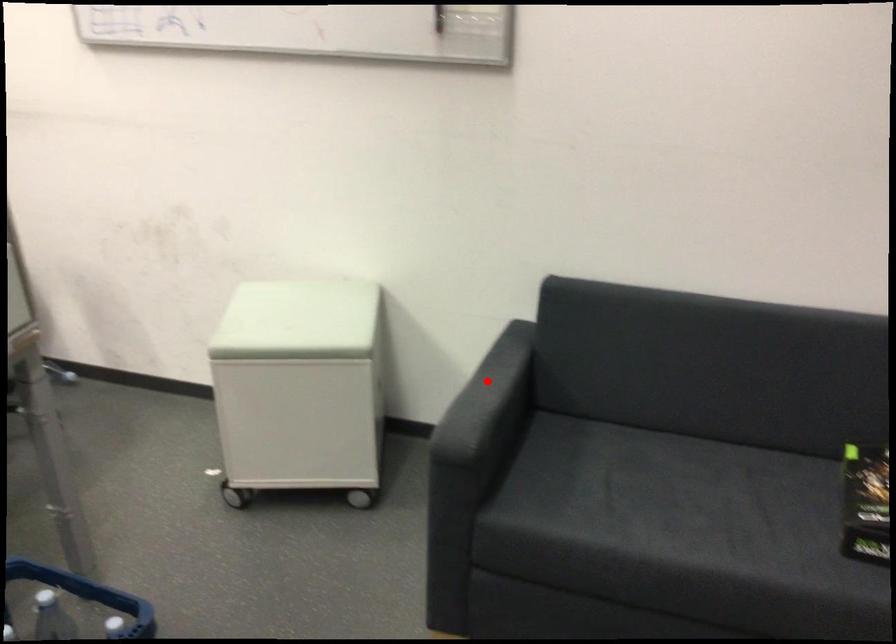
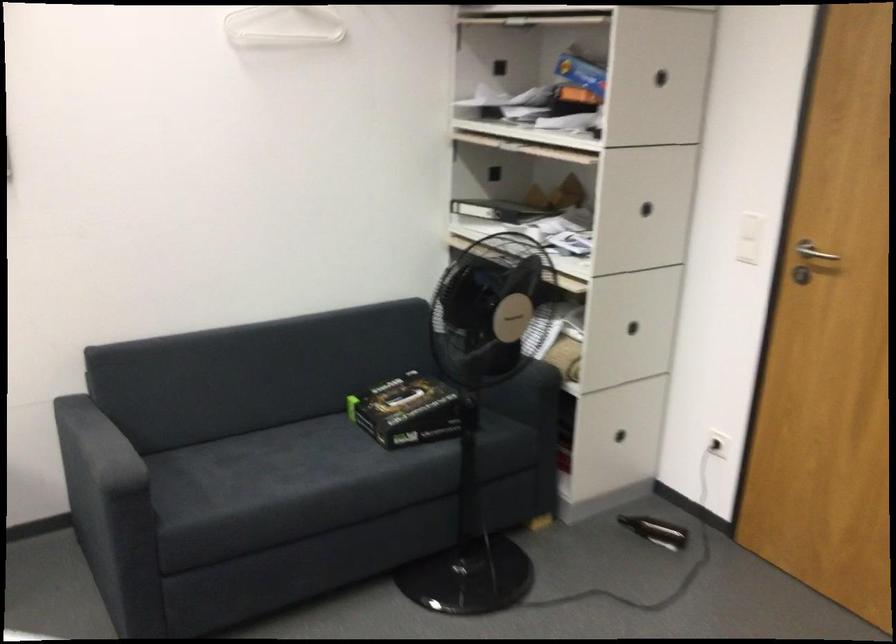
Question: I am providing you with two images of the same scene from different viewpoints. In image1, a red point is highlighted. Considering the same 3D point in image2, which of the following is correct?

Choices:
 (A) It is closer
 (B) It is farther

Answer: (B)